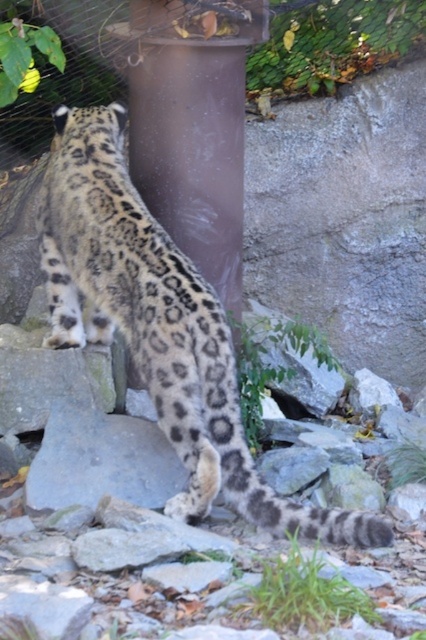
You are standing at the camera position and want to take a photo of the snow leopard. If you move forward 1 meter towards the point at coordinates point (169,205), will you be closer to the snow leopard than the camera was originally?

The point at coordinates point (169,205) is 3.95 meters away from the camera. If you move forward 1 meter towards this point, your new distance would be 2.95 meters, which is closer than the original 3.95 meters. Therefore, yes, you will be closer to the snow leopard than the camera was originally.

In the image of the snow leopard in its enclosure, there is a point marked at coordinates (160, 326). Which object does this point correspond to?

The point at coordinates (160, 326) corresponds to the spotted fur snow leopard at center.

You are a visitor at the zoo and want to take a photo of the snow leopard. You notice two points in the enclosure marked as point 1 at coordinates (146,138) and point 2 at coordinates (11,116). Which point is closer to your camera position?

Point 1 at coordinates (146,138) is closer to the camera than point 2 at coordinates (11,116).